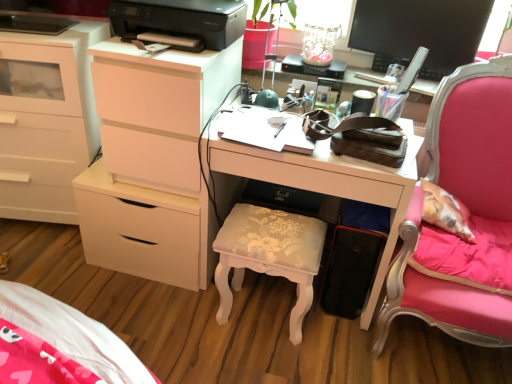
Question: Is black plastic printer at upper center surrounded by white matte chest of drawers at left, marked as the second chest of drawers in a right-to-left arrangement?

Choices:
 (A) no
 (B) yes

Answer: (A)

Question: Considering the relative sizes of white matte chest of drawers at left, marked as the second chest of drawers in a right-to-left arrangement, and black plastic printer at upper center in the image provided, is white matte chest of drawers at left, marked as the second chest of drawers in a right-to-left arrangement, thinner than black plastic printer at upper center?

Choices:
 (A) no
 (B) yes

Answer: (B)

Question: Considering the relative sizes of white matte chest of drawers at left, marked as the second chest of drawers in a right-to-left arrangement, and black plastic printer at upper center in the image provided, is white matte chest of drawers at left, marked as the second chest of drawers in a right-to-left arrangement, shorter than black plastic printer at upper center?

Choices:
 (A) no
 (B) yes

Answer: (A)

Question: Does white matte chest of drawers at left, the first chest of drawers in the left-to-right sequence, have a greater height compared to black plastic printer at upper center?

Choices:
 (A) yes
 (B) no

Answer: (A)

Question: From the image's perspective, is white matte chest of drawers at left, the first chest of drawers in the left-to-right sequence, located beneath black plastic printer at upper center?

Choices:
 (A) no
 (B) yes

Answer: (B)

Question: Visually, is white glossy desk at center positioned to the left or to the right of white matte chest of drawers at left, the 2th chest of drawers viewed from the left?

Choices:
 (A) right
 (B) left

Answer: (A)

Question: From a real-world perspective, is white glossy desk at center above or below white matte chest of drawers at left, the first chest of drawers viewed from the right?

Choices:
 (A) below
 (B) above

Answer: (B)

Question: Is point (143, 276) closer or farther from the camera than point (125, 44)?

Choices:
 (A) farther
 (B) closer

Answer: (A)

Question: Is white glossy desk at center taller or shorter than white matte chest of drawers at left, the 2th chest of drawers viewed from the left?

Choices:
 (A) short
 (B) tall

Answer: (B)

Question: From a real-world perspective, is white glossy desk at center above or below white matte chest of drawers at left, marked as the second chest of drawers in a right-to-left arrangement?

Choices:
 (A) above
 (B) below

Answer: (B)

Question: Would you say white glossy desk at center is to the left or to the right of white matte chest of drawers at left, the first chest of drawers in the left-to-right sequence, in the picture?

Choices:
 (A) left
 (B) right

Answer: (B)

Question: From the image's perspective, is white glossy desk at center located above or below white matte chest of drawers at left, the first chest of drawers in the left-to-right sequence?

Choices:
 (A) above
 (B) below

Answer: (B)

Question: Which is correct: white glossy desk at center is inside white matte chest of drawers at left, the first chest of drawers in the left-to-right sequence, or outside of it?

Choices:
 (A) outside
 (B) inside

Answer: (A)

Question: Considering the positions of pink fabric chair at right and white glossy desk at center in the image, is pink fabric chair at right taller or shorter than white glossy desk at center?

Choices:
 (A) tall
 (B) short

Answer: (A)

Question: Considering their positions, is pink fabric chair at right located in front of or behind white glossy desk at center?

Choices:
 (A) front
 (B) behind

Answer: (A)